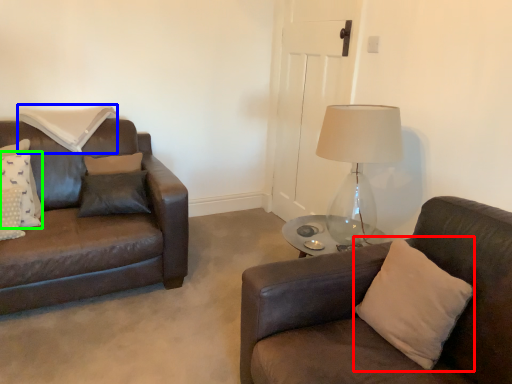
Question: Considering the real-world distances, which object is closest to pillow (highlighted by a red box)? pillow (highlighted by a blue box) or pillow (highlighted by a green box).

Choices:
 (A) pillow
 (B) pillow

Answer: (B)